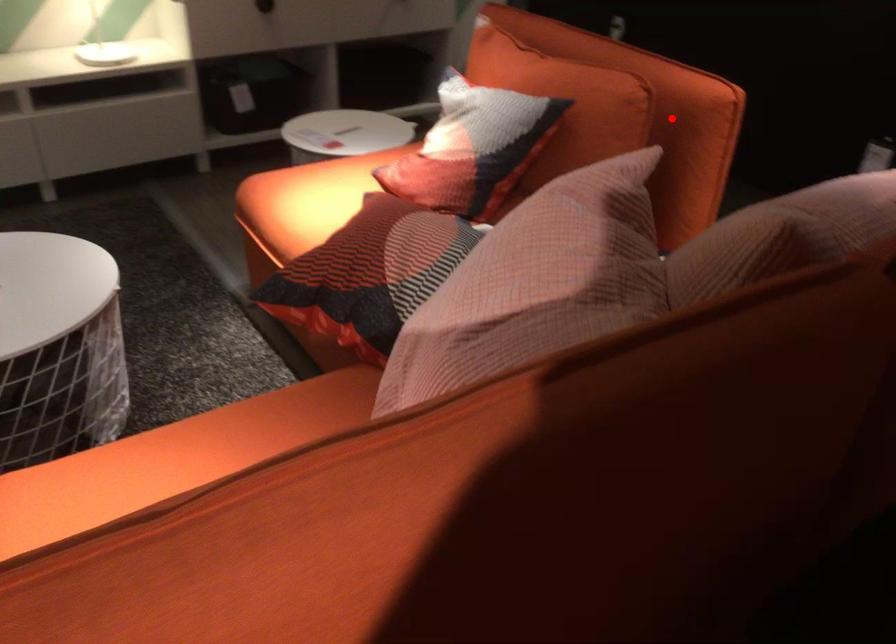
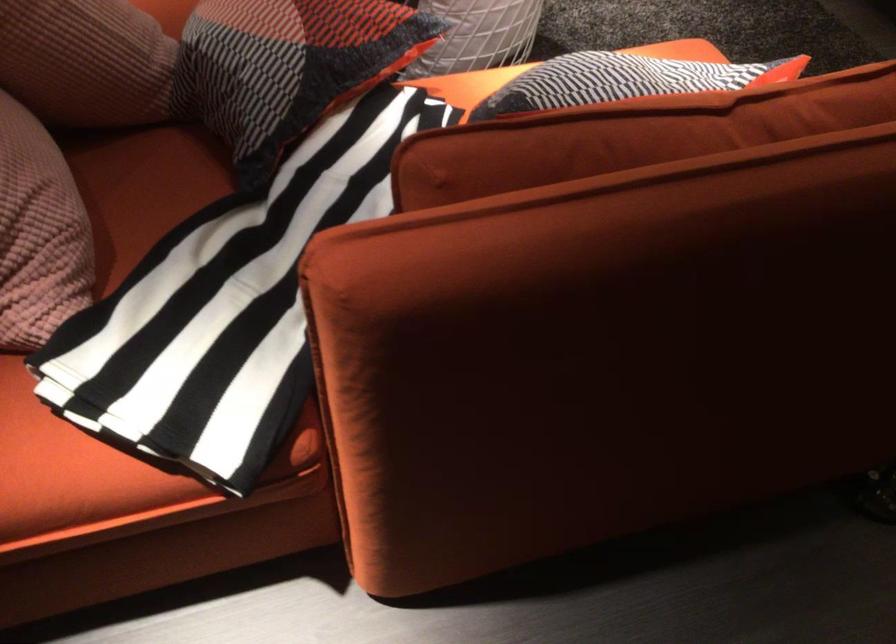
Question: I am providing you with two images of the same scene from different viewpoints. A red point is shown in image1. For the corresponding object point in image2, is it positioned nearer or farther from the camera?

Choices:
 (A) Nearer
 (B) Farther

Answer: (A)